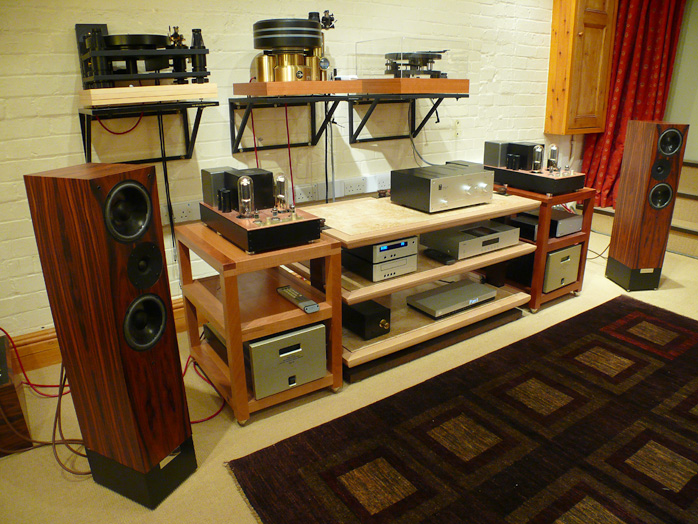
The image size is (698, 524). Find the location of `wall`. wall is located at coordinates (496, 30).